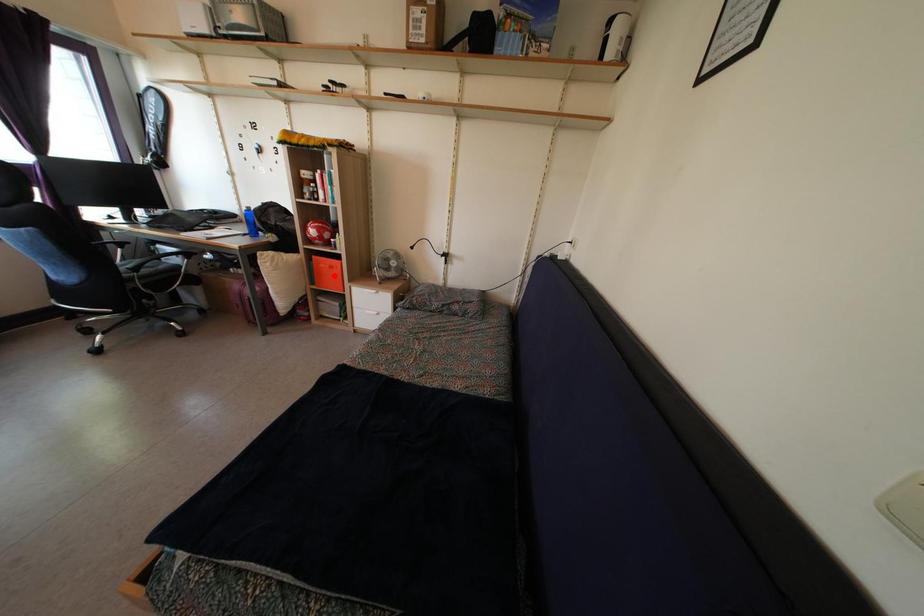
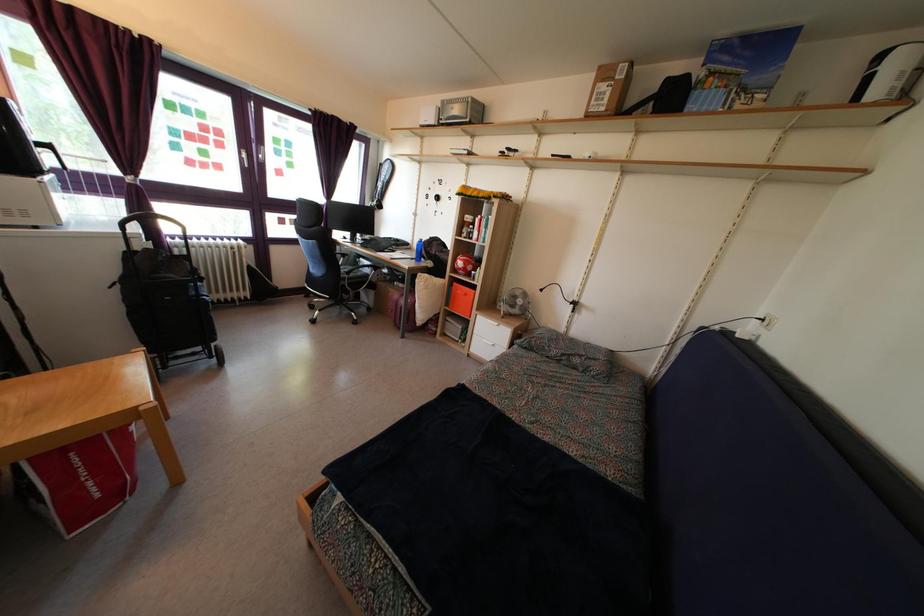
Find the pixel in the second image that matches the highlighted location in the first image.

(468, 302)